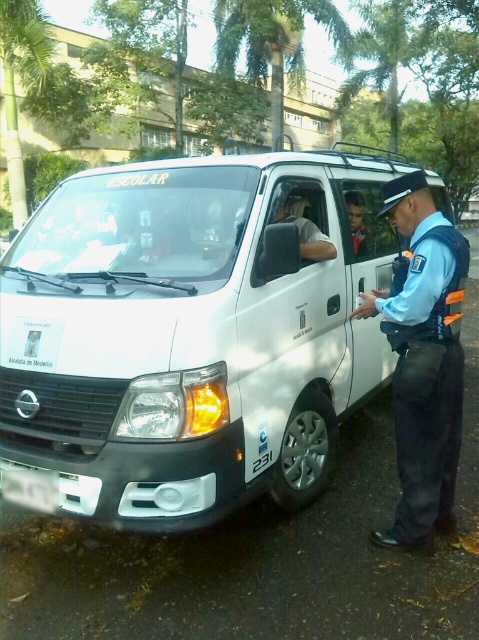
You are a pedestrian standing in front of the white Nissan school bus. You notice the blue uniform at right and the white plastic license plate at lower left. Which object is bigger in size?

The blue uniform at right is larger in size than the white plastic license plate at lower left.